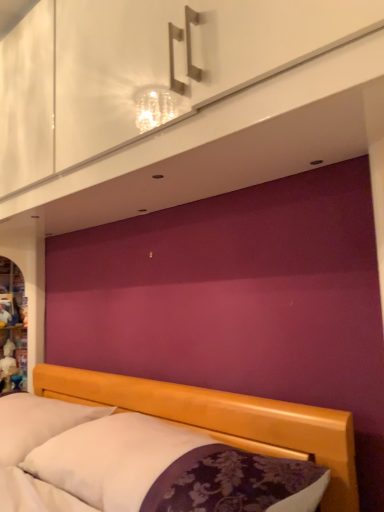
Question: Should I look upward or downward to see matte white cabinet at left?

Choices:
 (A) down
 (B) up

Answer: (A)

Question: Is matte white cabinet at left positioned in front of wooden bed at lower center?

Choices:
 (A) yes
 (B) no

Answer: (B)

Question: Could you tell me if matte white cabinet at left is facing wooden bed at lower center?

Choices:
 (A) no
 (B) yes

Answer: (A)

Question: Can you confirm if matte white cabinet at left is wider than wooden bed at lower center?

Choices:
 (A) yes
 (B) no

Answer: (B)

Question: Could wooden bed at lower center be considered to be inside matte white cabinet at left?

Choices:
 (A) no
 (B) yes

Answer: (A)

Question: Would you say matte white cabinet at left is a long distance from wooden bed at lower center?

Choices:
 (A) no
 (B) yes

Answer: (A)

Question: Does matte white cabinet at left have a lesser width compared to wooden bed at lower center?

Choices:
 (A) yes
 (B) no

Answer: (A)

Question: Is white glossy dresser at upper center thinner than white soft pillow at lower left?

Choices:
 (A) yes
 (B) no

Answer: (A)

Question: From a real-world perspective, does white glossy dresser at upper center stand above white soft pillow at lower left?

Choices:
 (A) no
 (B) yes

Answer: (B)

Question: Is white glossy dresser at upper center next to white soft pillow at lower left and touching it?

Choices:
 (A) no
 (B) yes

Answer: (A)

Question: From the image's perspective, is white glossy dresser at upper center below white soft pillow at lower left?

Choices:
 (A) yes
 (B) no

Answer: (B)

Question: From a real-world perspective, does white glossy dresser at upper center sit lower than white soft pillow at lower left?

Choices:
 (A) no
 (B) yes

Answer: (A)

Question: Is white glossy dresser at upper center smaller than white soft pillow at lower left?

Choices:
 (A) no
 (B) yes

Answer: (B)

Question: Does white soft pillow at lower left lie in front of wooden bed at lower center?

Choices:
 (A) yes
 (B) no

Answer: (B)